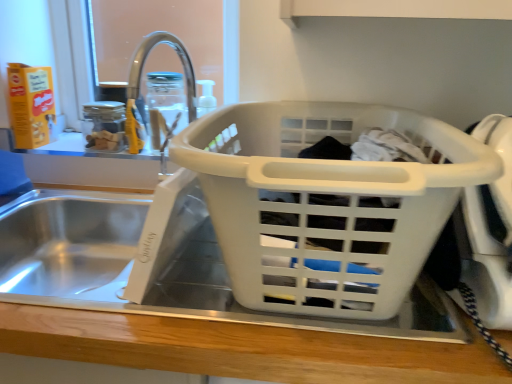
This screenshot has width=512, height=384. What do you see at coordinates (326, 193) in the screenshot? I see `white plastic laundry basket at center` at bounding box center [326, 193].

The height and width of the screenshot is (384, 512). I want to click on white plastic laundry basket at center, so click(326, 193).

You are a GUI agent. You are given a task and a screenshot of the screen. Output one action in this format:
    pyautogui.click(x=<x>, y=<y>)
    Task: Click on the transparent glass jar at upper center
    This screenshot has width=512, height=384.
    Given the screenshot: What is the action you would take?
    point(165,105)

Image resolution: width=512 pixels, height=384 pixels. What do you see at coordinates (165, 105) in the screenshot?
I see `transparent glass jar at upper center` at bounding box center [165, 105].

Where is `white plastic laundry basket at center`? The height and width of the screenshot is (384, 512). white plastic laundry basket at center is located at coordinates (326, 193).

Does white plastic laundry basket at center appear on the left side of transparent glass jar at upper center?

No.

Is the depth of white plastic laundry basket at center greater than that of transparent glass jar at upper center?

No, white plastic laundry basket at center is in front of transparent glass jar at upper center.

Which is behind, point (354, 228) or point (154, 110)?

Point (154, 110)

From the image's perspective, between white plastic laundry basket at center and transparent glass jar at upper center, which one is located above?

transparent glass jar at upper center appears higher in the image.

From a real-world perspective, is white plastic laundry basket at center positioned above or below transparent glass jar at upper center?

white plastic laundry basket at center is below transparent glass jar at upper center.

Between white plastic laundry basket at center and transparent glass jar at upper center, which one has smaller width?

With smaller width is transparent glass jar at upper center.

From their relative heights in the image, would you say white plastic laundry basket at center is taller or shorter than transparent glass jar at upper center?

Clearly, white plastic laundry basket at center is taller compared to transparent glass jar at upper center.

Based on their sizes in the image, would you say white plastic laundry basket at center is bigger or smaller than transparent glass jar at upper center?

Considering their sizes, white plastic laundry basket at center takes up more space than transparent glass jar at upper center.

Can transparent glass jar at upper center be found inside white plastic laundry basket at center?

No.

Are white plastic laundry basket at center and transparent glass jar at upper center beside each other?

They are not placed beside each other.

Could you tell me if white plastic laundry basket at center is facing transparent glass jar at upper center?

No, white plastic laundry basket at center does not turn towards transparent glass jar at upper center.

What's the angular difference between white plastic laundry basket at center and transparent glass jar at upper center's facing directions?

They differ by 4.47 degrees in their facing directions.

I want to click on bottle above the white plastic laundry basket at center (from a real-world perspective), so click(x=165, y=105).

Considering the relative positions of transparent glass jar at upper center and white plastic laundry basket at center in the image provided, is transparent glass jar at upper center to the right of white plastic laundry basket at center from the viewer's perspective?

Incorrect, transparent glass jar at upper center is not on the right side of white plastic laundry basket at center.

Does transparent glass jar at upper center lie behind white plastic laundry basket at center?

Yes, transparent glass jar at upper center is behind white plastic laundry basket at center.

Consider the image. Which is further, (165, 109) or (243, 292)?

The point (165, 109) is farther from the camera.

From the image's perspective, is transparent glass jar at upper center below white plastic laundry basket at center?

Incorrect, from the image's perspective, transparent glass jar at upper center is higher than white plastic laundry basket at center.

From a real-world perspective, is transparent glass jar at upper center physically located above or below white plastic laundry basket at center?

transparent glass jar at upper center is situated higher than white plastic laundry basket at center in the real world.

Between transparent glass jar at upper center and white plastic laundry basket at center, which one has smaller width?

transparent glass jar at upper center is thinner.

Which of these two, transparent glass jar at upper center or white plastic laundry basket at center, stands shorter?

With less height is transparent glass jar at upper center.

Does transparent glass jar at upper center have a larger size compared to white plastic laundry basket at center?

Incorrect, transparent glass jar at upper center is not larger than white plastic laundry basket at center.

Is transparent glass jar at upper center not within white plastic laundry basket at center?

transparent glass jar at upper center lies outside white plastic laundry basket at center's area.

Is transparent glass jar at upper center directly adjacent to white plastic laundry basket at center?

They are not placed beside each other.

Is transparent glass jar at upper center turned away from white plastic laundry basket at center?

transparent glass jar at upper center does not have its back to white plastic laundry basket at center.

How many degrees apart are the facing directions of transparent glass jar at upper center and white plastic laundry basket at center?

The angular difference between transparent glass jar at upper center and white plastic laundry basket at center is 4.47 degrees.

Find the location of a particular element. basket below the transparent glass jar at upper center (from the image's perspective) is located at coordinates coord(326,193).

Identify the location of basket that is below the transparent glass jar at upper center (from the image's perspective). Image resolution: width=512 pixels, height=384 pixels. tap(326, 193).

Locate an element on the screen. This screenshot has width=512, height=384. bottle behind the white plastic laundry basket at center is located at coordinates (165, 105).